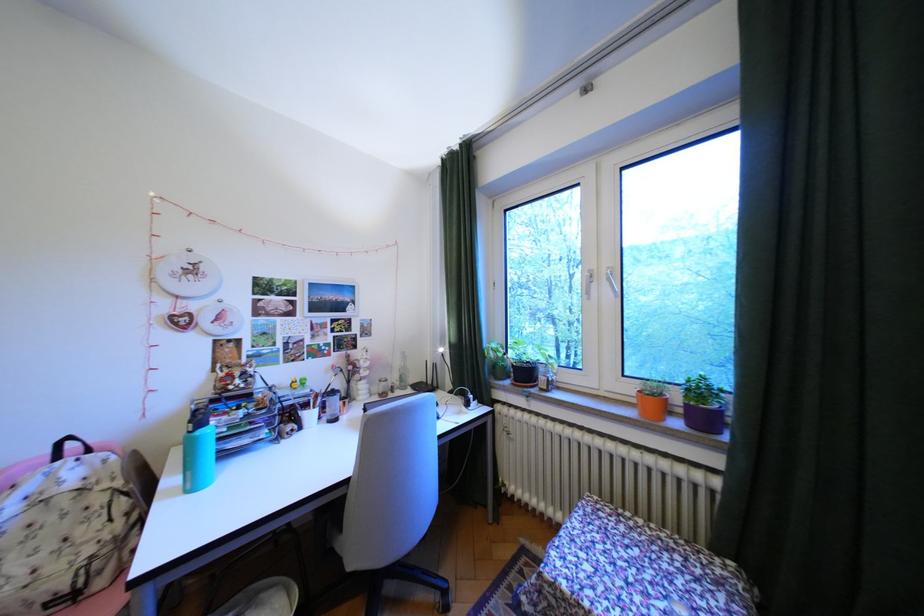
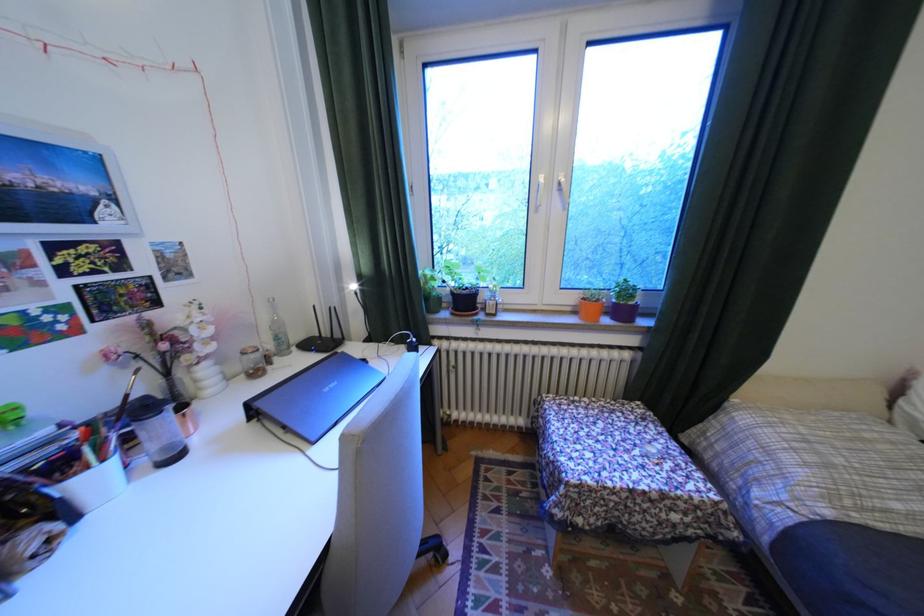
Where in the second image is the point corresponding to point (517, 369) from the first image?

(451, 299)